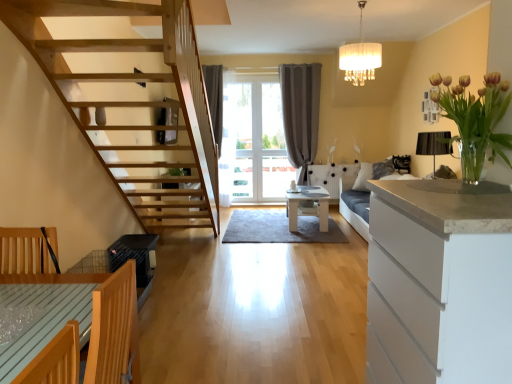
What do you see at coordinates (360, 57) in the screenshot?
I see `white fabric lampshade at upper center` at bounding box center [360, 57].

Describe the element at coordinates (45, 313) in the screenshot. I see `light brown wooden table at lower left, positioned as the 1th table in bottom-to-top order` at that location.

The image size is (512, 384). Describe the element at coordinates (307, 205) in the screenshot. I see `white glossy table at center, which is the 1th table in top-to-bottom order` at that location.

What do you see at coordinates (475, 119) in the screenshot?
I see `translucent glass vase at upper right` at bounding box center [475, 119].

Locate an element on the screen. Image resolution: width=512 pixels, height=384 pixels. white fabric lampshade at upper center is located at coordinates (360, 57).

Between white matte cabinet at right and translucent glass vase at upper right, which one has smaller width?

translucent glass vase at upper right.

Is white matte cabinet at right in contact with translucent glass vase at upper right?

No, white matte cabinet at right is not next to translucent glass vase at upper right.

Could you tell me if white matte cabinet at right is turned towards translucent glass vase at upper right?

No, white matte cabinet at right does not turn towards translucent glass vase at upper right.

Which is closer, (406, 354) or (485, 105)?

The point (406, 354) is closer.

Is translucent glass vase at upper right thinner than white fabric lampshade at upper center?

Correct, the width of translucent glass vase at upper right is less than that of white fabric lampshade at upper center.

How many degrees apart are the facing directions of translucent glass vase at upper right and white fabric lampshade at upper center?

translucent glass vase at upper right and white fabric lampshade at upper center are facing 1.87 degrees away from each other.

Is translucent glass vase at upper right far away from white fabric lampshade at upper center?

Yes, translucent glass vase at upper right is far from white fabric lampshade at upper center.

From the image's perspective, does translucent glass vase at upper right appear lower than white fabric lampshade at upper center?

Yes, from the image's perspective, translucent glass vase at upper right is below white fabric lampshade at upper center.

Is light brown wooden table at lower left, marked as the second table in a right-to-left arrangement, not near white matte cabinet at right?

Yes, light brown wooden table at lower left, marked as the second table in a right-to-left arrangement, and white matte cabinet at right are located far from each other.

Is point (95, 279) farther from viewer compared to point (369, 309)?

Yes, point (95, 279) is behind point (369, 309).

From the image's perspective, is light brown wooden table at lower left, the second table when ordered from back to front, above or below white matte cabinet at right?

Based on their image positions, light brown wooden table at lower left, the second table when ordered from back to front, is located beneath white matte cabinet at right.

Is light brown wooden table at lower left, marked as the second table in a right-to-left arrangement, positioned beyond the bounds of white matte cabinet at right?

Indeed, light brown wooden table at lower left, marked as the second table in a right-to-left arrangement, is completely outside white matte cabinet at right.

Based on the photo, is white glossy table at center, positioned as the 1th table in right-to-left order, oriented away from white matte cabinet at right?

No, white matte cabinet at right is not at the back of white glossy table at center, positioned as the 1th table in right-to-left order.

How far apart are white glossy table at center, the 1th table in the back-to-front sequence, and white matte cabinet at right?

white glossy table at center, the 1th table in the back-to-front sequence, is 12.64 feet from white matte cabinet at right.

Does white glossy table at center, the second table when ordered from left to right, lie behind white matte cabinet at right?

Yes, white glossy table at center, the second table when ordered from left to right, is further from the viewer.

Is white glossy table at center, the 1th table in the back-to-front sequence, beside white matte cabinet at right?

white glossy table at center, the 1th table in the back-to-front sequence, and white matte cabinet at right are clearly separated.

Is light brown wooden table at lower left, which is the 1th table from front to back, aimed at gray fabric curtain at center?

No.

Looking at the image, does light brown wooden table at lower left, positioned as the 1th table in bottom-to-top order, seem bigger or smaller compared to gray fabric curtain at center?

Clearly, light brown wooden table at lower left, positioned as the 1th table in bottom-to-top order, is smaller in size than gray fabric curtain at center.

Based on the photo, which object is thinner, light brown wooden table at lower left, the second table viewed from the top, or gray fabric curtain at center?

gray fabric curtain at center.

From the image's perspective, is light brown wooden table at lower left, the second table when ordered from back to front, located above or below gray fabric curtain at center?

light brown wooden table at lower left, the second table when ordered from back to front, is below gray fabric curtain at center.

Does light brown wooden table at lower left, which is the 1th table from front to back, contain white fabric lampshade at upper center?

Definitely not — white fabric lampshade at upper center is not inside light brown wooden table at lower left, which is the 1th table from front to back.

Which of these two, light brown wooden table at lower left, positioned as the 1th table in bottom-to-top order, or white fabric lampshade at upper center, is thinner?

white fabric lampshade at upper center.

From a real-world perspective, is light brown wooden table at lower left, marked as the second table in a right-to-left arrangement, physically above white fabric lampshade at upper center?

Incorrect, from a real-world perspective, light brown wooden table at lower left, marked as the second table in a right-to-left arrangement, is lower than white fabric lampshade at upper center.

Between light brown wooden table at lower left, which is the 1th table from front to back, and white fabric lampshade at upper center, which one is positioned in front?

light brown wooden table at lower left, which is the 1th table from front to back, is more forward.

Is gray fabric curtain at center a part of white matte cabinet at right?

That's incorrect, gray fabric curtain at center is not inside white matte cabinet at right.

Is point (490, 374) closer or farther from the camera than point (285, 81)?

Clearly, point (490, 374) is closer to the camera than point (285, 81).

Considering the relative positions of white matte cabinet at right and gray fabric curtain at center in the image provided, is white matte cabinet at right to the left of gray fabric curtain at center from the viewer's perspective?

Incorrect, white matte cabinet at right is not on the left side of gray fabric curtain at center.

At what (x,y) coordinates should I click in order to perform the action: click on cabinetry below the translucent glass vase at upper right (from the image's perspective). Please return your answer as a coordinate pair (x, y). This screenshot has width=512, height=384. Looking at the image, I should click on (439, 286).

Where is `lamp above the translucent glass vase at upper right (from the image's perspective)`? Image resolution: width=512 pixels, height=384 pixels. lamp above the translucent glass vase at upper right (from the image's perspective) is located at coordinates (360, 57).

From the picture: Estimate the real-world distances between objects in this image. Which object is further from white glossy table at center, marked as the 2th table in a bottom-to-top arrangement, gray fabric curtain at center or white matte cabinet at right?

white matte cabinet at right is further to white glossy table at center, marked as the 2th table in a bottom-to-top arrangement.

Considering their positions, is light brown wooden table at lower left, marked as the 1th table in a left-to-right arrangement, positioned further to gray fabric curtain at center than white matte cabinet at right?

Among the two, light brown wooden table at lower left, marked as the 1th table in a left-to-right arrangement, is located further to gray fabric curtain at center.

Based on their spatial positions, is white glossy table at center, which ranks as the second table in front-to-back order, or gray fabric curtain at center closer to white fabric lampshade at upper center?

white glossy table at center, which ranks as the second table in front-to-back order.

Based on their spatial positions, is translucent glass vase at upper right or gray fabric curtain at center further from white matte cabinet at right?

gray fabric curtain at center.

Considering their positions, is translucent glass vase at upper right positioned closer to gray fabric curtain at center than white fabric lampshade at upper center?

Based on the image, white fabric lampshade at upper center appears to be nearer to gray fabric curtain at center.

Considering their positions, is light brown wooden table at lower left, the second table viewed from the top, positioned closer to gray fabric curtain at center than white glossy table at center, the 1th table in the back-to-front sequence?

white glossy table at center, the 1th table in the back-to-front sequence, is closer to gray fabric curtain at center.

Looking at the image, which one is located closer to translucent glass vase at upper right, light brown wooden table at lower left, which is the 1th table from front to back, or white glossy table at center, which ranks as the second table in front-to-back order?

light brown wooden table at lower left, which is the 1th table from front to back.

From the picture: Considering their positions, is white matte cabinet at right positioned further to white fabric lampshade at upper center than translucent glass vase at upper right?

white matte cabinet at right.

What are the coordinates of `table between white matte cabinet at right and white glossy table at center, positioned as the 1th table in right-to-left order, from front to back` in the screenshot? It's located at (45, 313).

Identify the location of flower between white matte cabinet at right and white glossy table at center, which ranks as the second table in front-to-back order, from front to back. The height and width of the screenshot is (384, 512). (475, 119).

Where is `table between white fabric lampshade at upper center and gray fabric curtain at center along the z-axis`? This screenshot has height=384, width=512. table between white fabric lampshade at upper center and gray fabric curtain at center along the z-axis is located at coordinates (307, 205).

Where is `flower positioned between white matte cabinet at right and gray fabric curtain at center from near to far`? flower positioned between white matte cabinet at right and gray fabric curtain at center from near to far is located at coordinates [x=475, y=119].